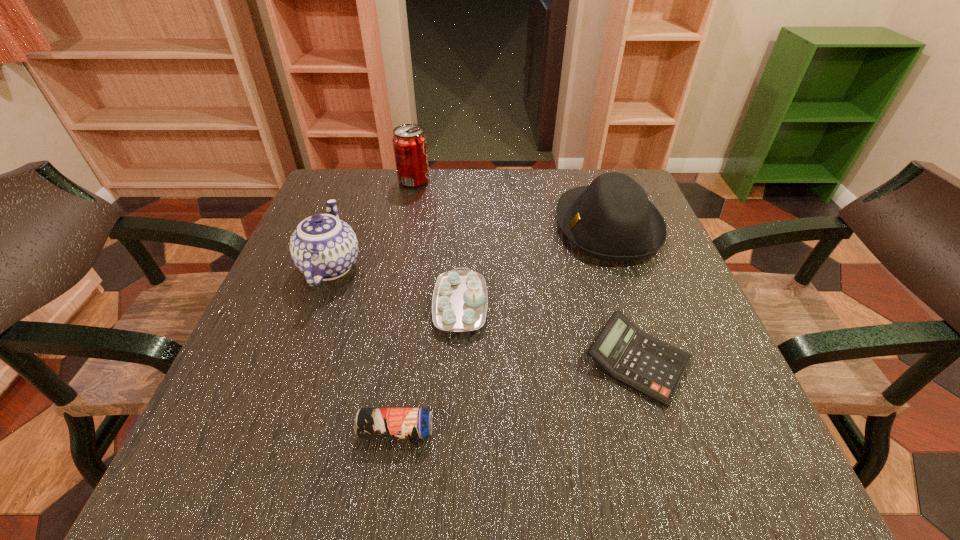
Locate an element on the screen. The width and height of the screenshot is (960, 540). object that is at the near edge is located at coordinates (370, 423).

Locate an element on the screen. object located at the left edge is located at coordinates (323, 247).

I want to click on fedora that is at the right edge, so click(x=612, y=219).

Identify the location of calculator that is positioned at the right edge. This screenshot has height=540, width=960. (652, 367).

Find the location of a particular element. object that is positioned at the far right corner is located at coordinates (612, 219).

In the image, there is a desktop. Where is `free space at the far edge`? This screenshot has width=960, height=540. free space at the far edge is located at coordinates (498, 191).

What are the coordinates of `free location at the near edge of the desktop` in the screenshot? It's located at (617, 472).

In the image, there is a desktop. Find the location of `vacant space at the left edge`. vacant space at the left edge is located at coordinates (260, 377).

The width and height of the screenshot is (960, 540). I want to click on free location at the right edge, so click(x=629, y=261).

This screenshot has height=540, width=960. I want to click on free point between the fourth tallest object and the fedora, so click(534, 266).